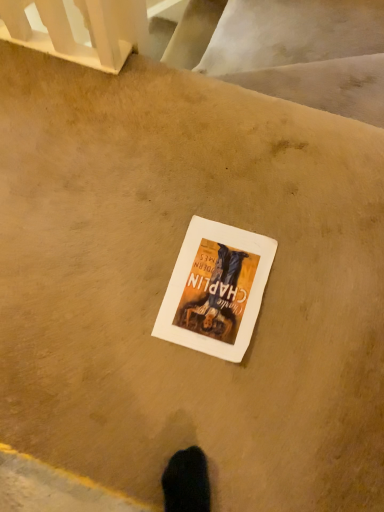
Image resolution: width=384 pixels, height=512 pixels. Find the location of `vacant area located to the right-hand side of white paper at center`. vacant area located to the right-hand side of white paper at center is located at coordinates click(314, 292).